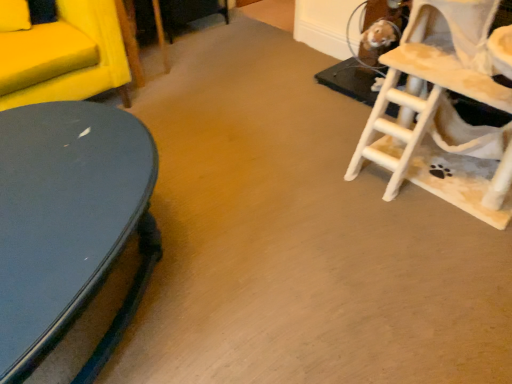
What are the coordinates of `vacant space underneath white wooden ladder at right (from a real-world perspective)` in the screenshot? It's located at (445, 193).